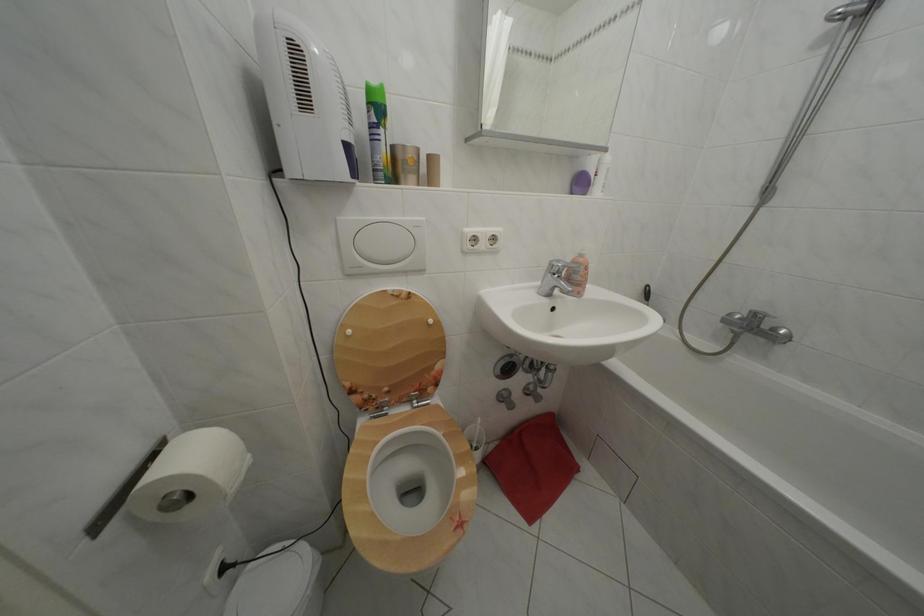
Find where to lift the wooden toilet lid. Please return your answer as a coordinate pair (x, y).

(388, 349)